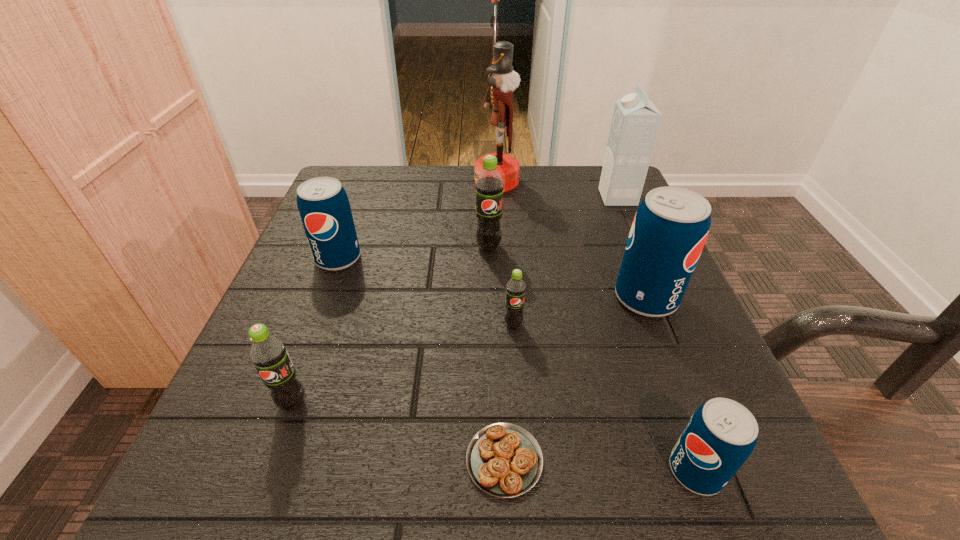
Where is `the nearest blue pop`? the nearest blue pop is located at coordinates (720, 436).

Where is `the smallest blue pop`? This screenshot has height=540, width=960. the smallest blue pop is located at coordinates (720, 436).

This screenshot has width=960, height=540. In order to click on pastry in this screenshot , I will do `click(504, 460)`.

In order to click on vacant area situated 0.280m on the front-facing side of the tallest object in this screenshot , I will do `click(358, 181)`.

Locate an element on the screen. The width and height of the screenshot is (960, 540). free space located 0.060m on the front-facing side of the tallest object is located at coordinates (449, 181).

This screenshot has height=540, width=960. I want to click on free space located 0.070m on the front-facing side of the tallest object, so [x=445, y=181].

Identify the location of vacant space situated 0.180m on the front label of the carton. This screenshot has width=960, height=540. (523, 197).

The image size is (960, 540). What are the coordinates of `free spot located on the front label of the carton` in the screenshot? It's located at (566, 197).

This screenshot has width=960, height=540. Identify the location of free space located on the front label of the carton. (453, 197).

Identify the location of vacant space located 0.170m on the back of the second nearest blue pop. (616, 224).